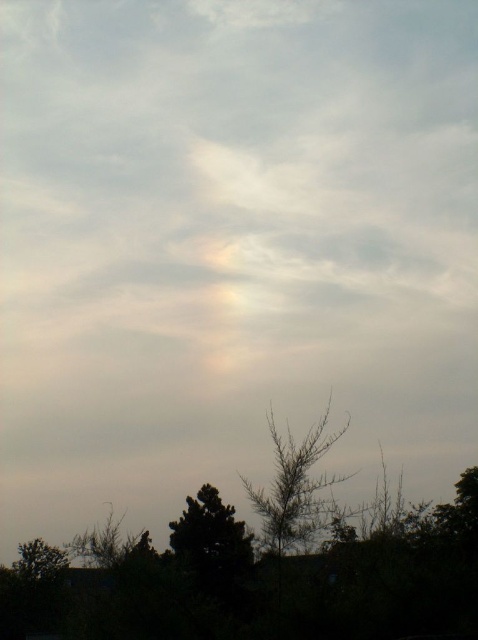
Question: Is green leafy tree at center further to camera compared to green matte tree at lower left?

Choices:
 (A) no
 (B) yes

Answer: (A)

Question: Is green leafy tree at center thinner than green matte tree at lower left?

Choices:
 (A) yes
 (B) no

Answer: (A)

Question: Which point appears farthest from the camera in this image?

Choices:
 (A) (56, 552)
 (B) (276, 436)

Answer: (A)

Question: Considering the relative positions of green leafy tree at center and green matte tree at lower left in the image provided, where is green leafy tree at center located with respect to green matte tree at lower left?

Choices:
 (A) above
 (B) below

Answer: (A)

Question: Among these points, which one is nearest to the camera?

Choices:
 (A) (202, 531)
 (B) (302, 490)

Answer: (B)

Question: Which object is the farthest from the green matte tree at lower center?

Choices:
 (A) green matte tree at lower left
 (B) green leafy tree at center

Answer: (B)